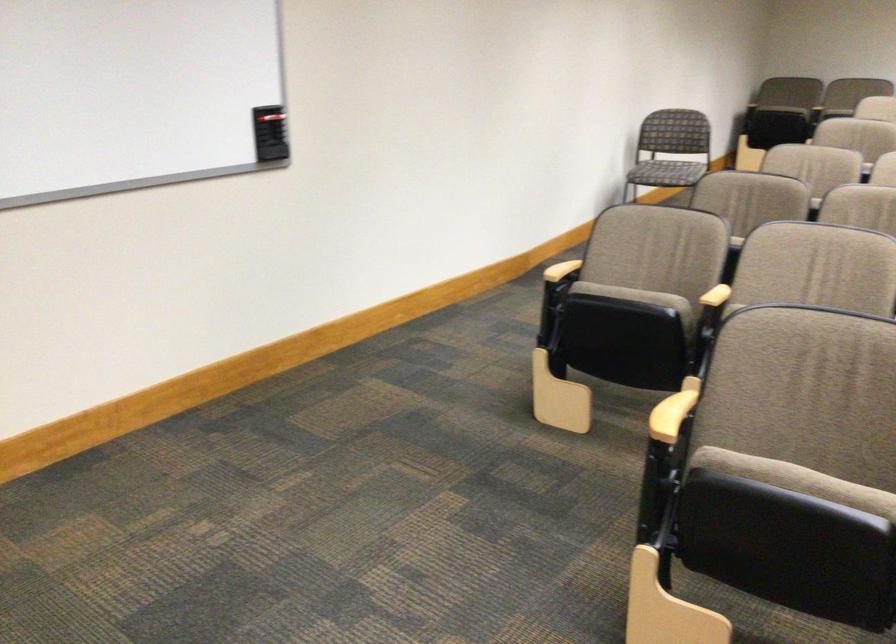
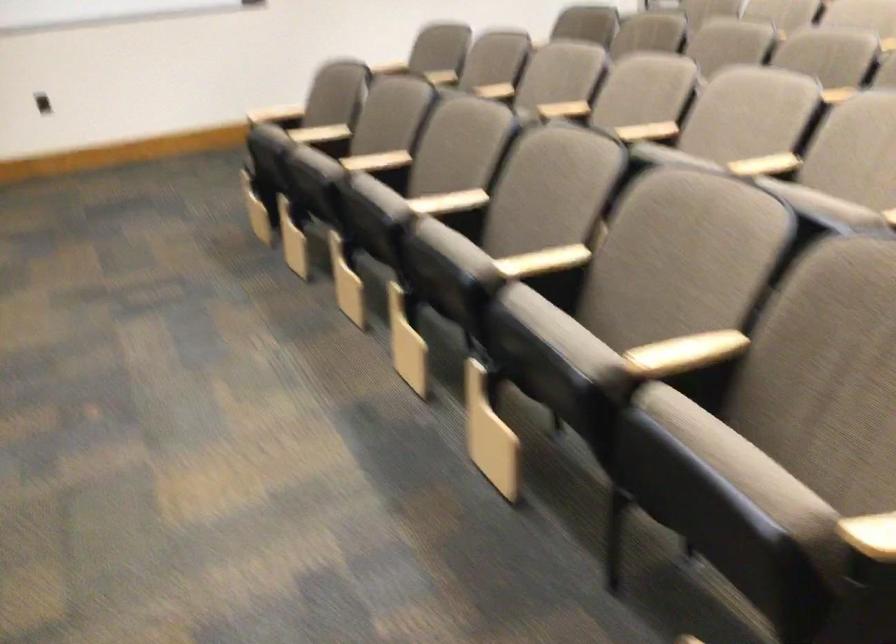
Which direction would the cameraman need to move to produce the second image?

The movement direction of the cameraman is right, backward.